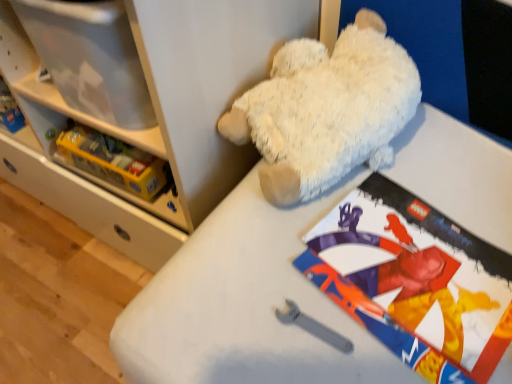
Question: Is white plush bear at upper right, acting as the first shelf starting from the front, smaller than matte paper comic book at upper center?

Choices:
 (A) no
 (B) yes

Answer: (A)

Question: From the image's perspective, is white plush bear at upper right, acting as the first shelf starting from the front, under matte paper comic book at upper center?

Choices:
 (A) yes
 (B) no

Answer: (B)

Question: Is white plush bear at upper right, the second shelf when ordered from back to front, far from matte paper comic book at upper center?

Choices:
 (A) no
 (B) yes

Answer: (A)

Question: Does white plush bear at upper right, the second shelf when ordered from back to front, have a lesser height compared to matte paper comic book at upper center?

Choices:
 (A) no
 (B) yes

Answer: (A)

Question: Is white plush bear at upper right, acting as the first shelf starting from the front, outside of matte paper comic book at upper center?

Choices:
 (A) no
 (B) yes

Answer: (B)

Question: Does white plush bear at upper right, acting as the first shelf starting from the front, appear on the right side of matte paper comic book at upper center?

Choices:
 (A) no
 (B) yes

Answer: (A)

Question: Is white plush teddy bear at upper center oriented towards yellow plastic lego box at left, the second shelf in the front-to-back sequence?

Choices:
 (A) yes
 (B) no

Answer: (B)

Question: From the image's perspective, does white plush teddy bear at upper center appear higher than yellow plastic lego box at left, arranged as the 1th shelf when viewed from the back?

Choices:
 (A) yes
 (B) no

Answer: (A)

Question: Is white plush teddy bear at upper center at the right side of yellow plastic lego box at left, the second shelf in the front-to-back sequence?

Choices:
 (A) no
 (B) yes

Answer: (B)

Question: Is white plush teddy bear at upper center not near yellow plastic lego box at left, arranged as the 1th shelf when viewed from the back?

Choices:
 (A) yes
 (B) no

Answer: (B)

Question: Is white plush teddy bear at upper center to the left of yellow plastic lego box at left, the second shelf in the front-to-back sequence, from the viewer's perspective?

Choices:
 (A) no
 (B) yes

Answer: (A)

Question: From a real-world perspective, does white plush teddy bear at upper center stand above yellow plastic lego box at left, the second shelf in the front-to-back sequence?

Choices:
 (A) yes
 (B) no

Answer: (A)

Question: From a real-world perspective, is yellow plastic lego box at left, arranged as the 1th shelf when viewed from the back, positioned over white plush bear at upper right, the second shelf when ordered from back to front, based on gravity?

Choices:
 (A) no
 (B) yes

Answer: (A)